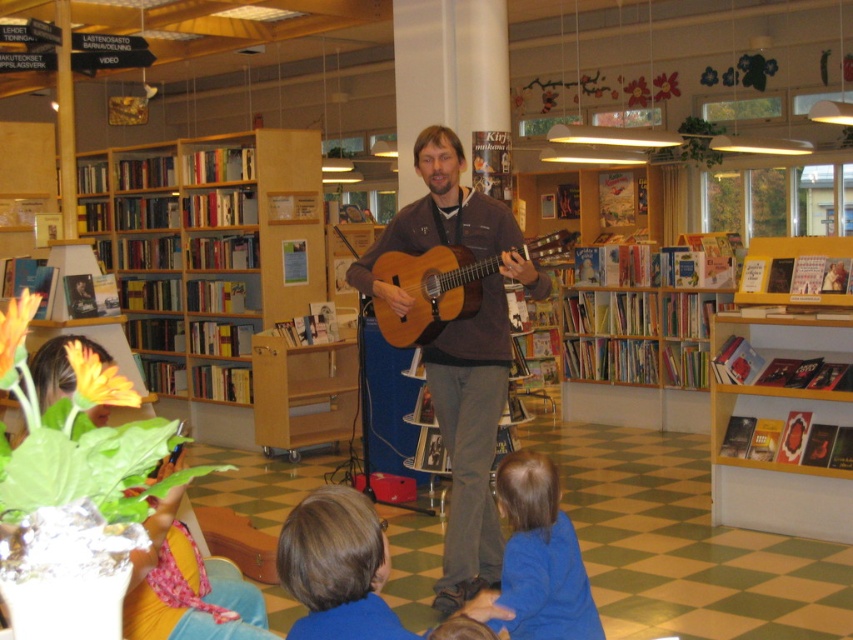
Based on the photo, you are a visitor in the library and want to take a photo of the blonde hair at lower center without the wooden bookshelf at left blocking the view. Where should you stand to achieve this?

To take a photo of the blonde hair at lower center without the wooden bookshelf at left blocking the view, you should stand to the right side of the scene. Since the wooden bookshelf at left is positioned over the blonde hair at lower center, moving to the right would allow you to capture the subject without the shelf obscuring it.

You are a visitor in this library and want to place a large potted plant that takes up the same space as the wooden bookshelf at left next to the blonde hair at lower center. Will there be enough space?

The wooden bookshelf at left is larger in size than the blonde hair at lower center. Since the potted plant would take up the same space as the wooden bookshelf at left, placing it next to the blonde hair at lower center may not leave enough space as the existing space allocated for the blonde hair at lower center is smaller.